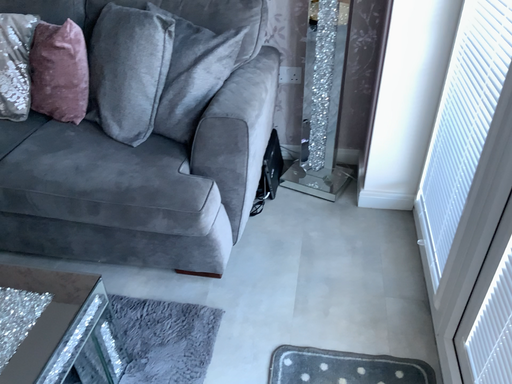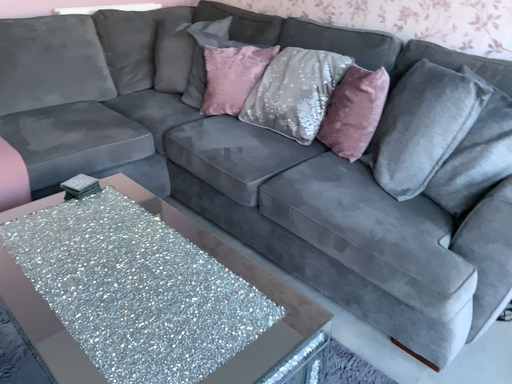
Question: How did the camera likely rotate when shooting the video?

Choices:
 (A) rotated left
 (B) rotated right

Answer: (A)